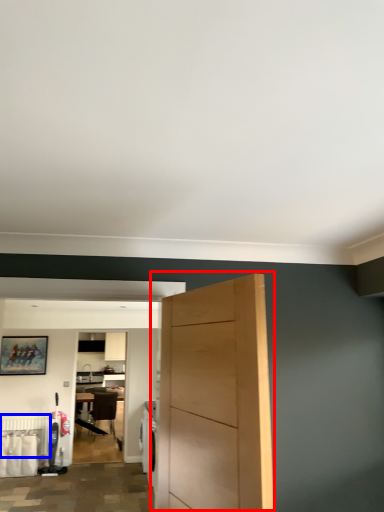
Question: Which object is closer to the camera taking this photo, door (highlighted by a red box) or radiator (highlighted by a blue box)?

Choices:
 (A) door
 (B) radiator

Answer: (A)